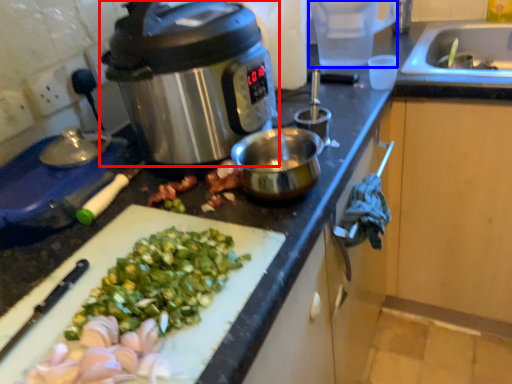
Question: Among these objects, which one is nearest to the camera, slow cooker (highlighted by a red box) or appliance (highlighted by a blue box)?

Choices:
 (A) slow cooker
 (B) appliance

Answer: (A)